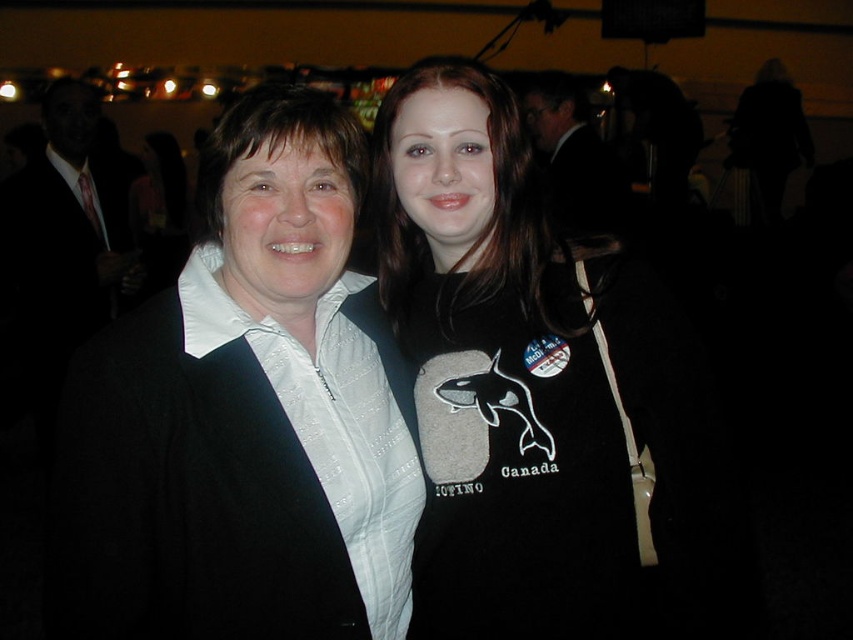
You are a photographer trying to capture a candid shot of the two people in the scene. You need to ensure there is enough space between the matte black jacket at left and the black matte sweatshirt at center to avoid blurring both in the photo. The minimum required distance for your camera to focus clearly on both subjects is 10 inches. Can you achieve this with the current positioning?

The matte black jacket at left is only 8.80 inches from the black matte sweatshirt at center, which is less than the required 10 inches. Therefore, the camera cannot focus clearly on both subjects without blurring due to the insufficient distance between them.